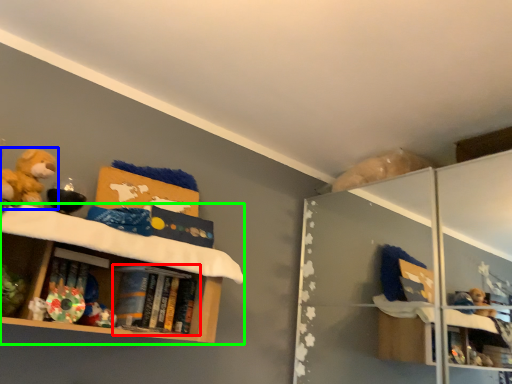
Question: Considering the real-world distances, which object is farthest from book (highlighted by a red box)? toy (highlighted by a blue box) or shelf (highlighted by a green box)?

Choices:
 (A) toy
 (B) shelf

Answer: (A)